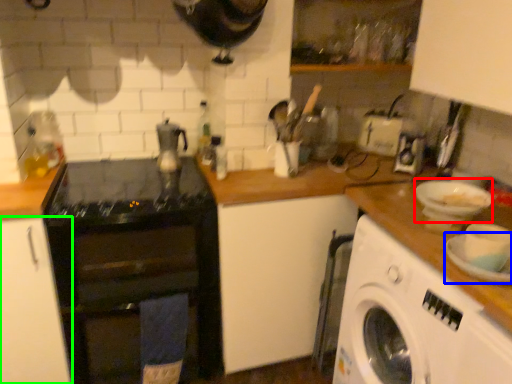
Question: Which is farther away from basin (highlighted by a red box)? plate (highlighted by a blue box) or cabinetry (highlighted by a green box)?

Choices:
 (A) plate
 (B) cabinetry

Answer: (B)